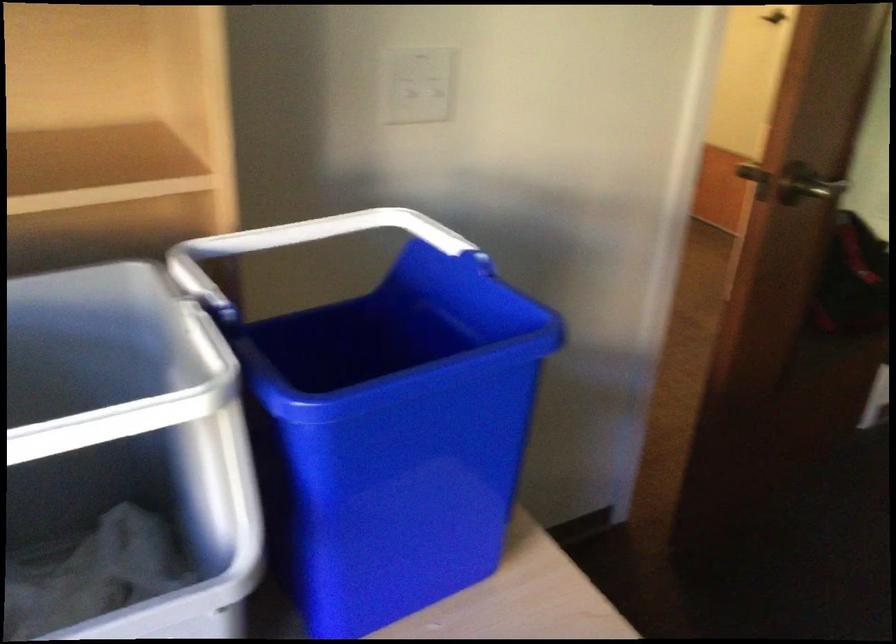
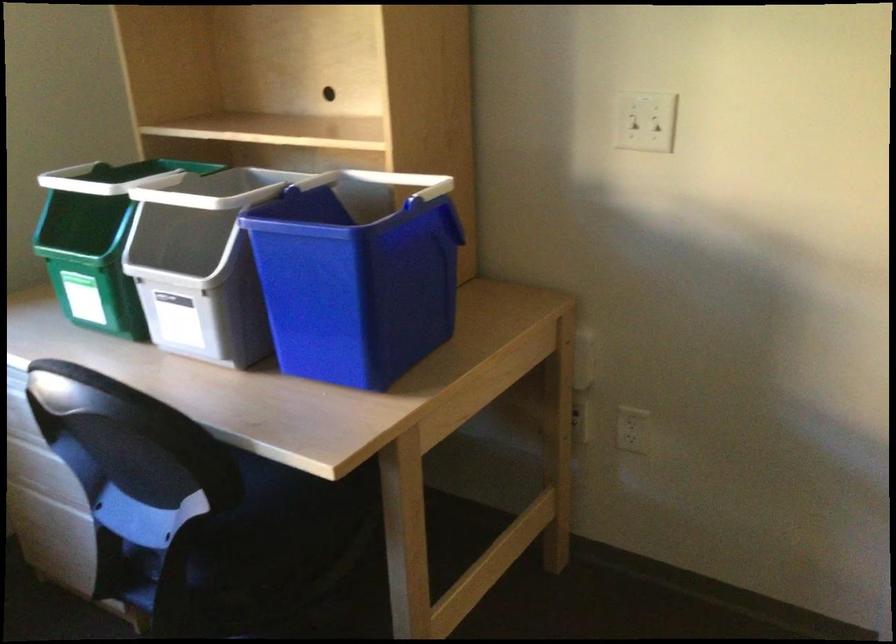
Find the pixel in the second image that matches (296,238) in the first image.

(399, 181)